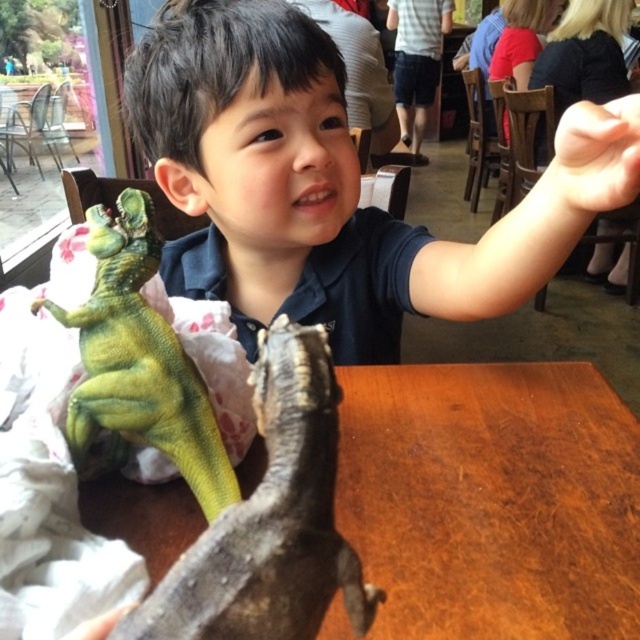
The user is trying to locate the exact position of the toy dinosaur in the image. They are given coordinates in a coordinate system where the bottom left corner is the origin. The coordinates provided are point [272,518]. According to the image description, where is this point located?

The point [272,518] is on the leather like brown lizard at center.